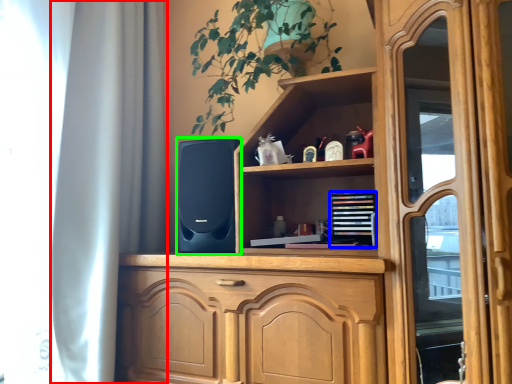
Question: Based on their relative distances, which object is nearer to curtain (highlighted by a red box)? Choose from book (highlighted by a blue box) and speaker (highlighted by a green box).

Choices:
 (A) book
 (B) speaker

Answer: (B)